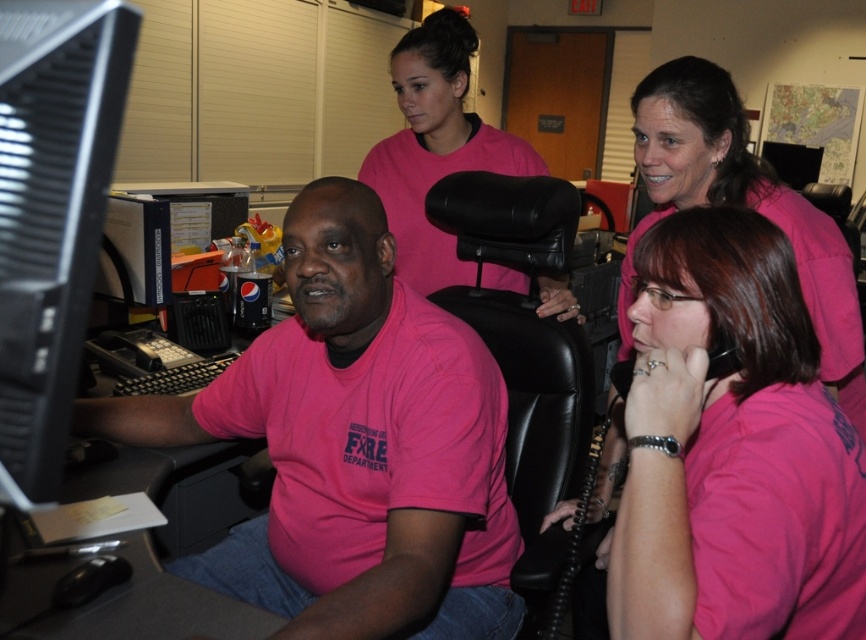
You are an office worker who needs to locate the pink matte shirt at center and the black plastic monitor at left. According to the scene, which object is positioned to the right side?

The black plastic monitor at left is positioned to the right of the pink matte shirt at center.

You are standing in the office and want to reach a point that is 30 inches away from you. Is the point at coordinates point (x=658, y=593) within your target distance?

The point (x=658, y=593) is 31.36 inches away from the viewer, which is slightly beyond the 30 inches target distance.

You are an office worker who needs to hang a name tag on the pink matte shirt at center. The name tag is 15 cm wide. Can the name tag fit on the shirt if the black plastic monitor at left is 20 cm wide?

The pink matte shirt at center might be wider than black plastic monitor at left, which is 20 cm wide. Therefore, the name tag of 15 cm can fit on the shirt since the shirt is at least as wide as the monitor.